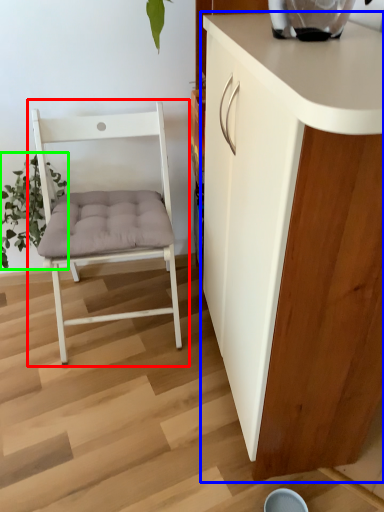
Question: Based on their relative distances, which object is nearer to chair (highlighted by a red box)? Choose from cabinetry (highlighted by a blue box) and plant (highlighted by a green box).

Choices:
 (A) cabinetry
 (B) plant

Answer: (B)